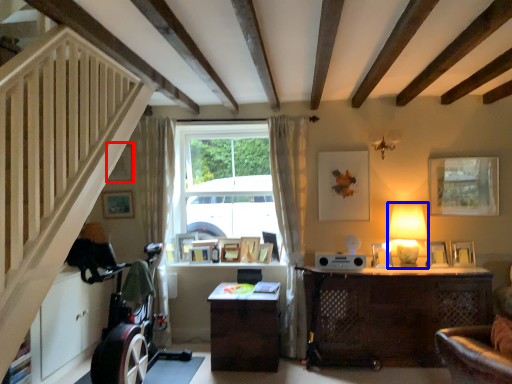
Question: Which object is further to the camera taking this photo, picture frame (highlighted by a red box) or table lamp (highlighted by a blue box)?

Choices:
 (A) picture frame
 (B) table lamp

Answer: (A)